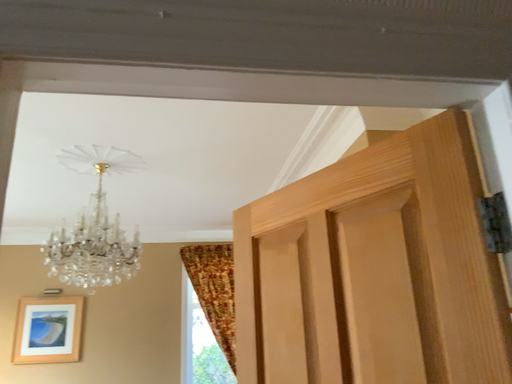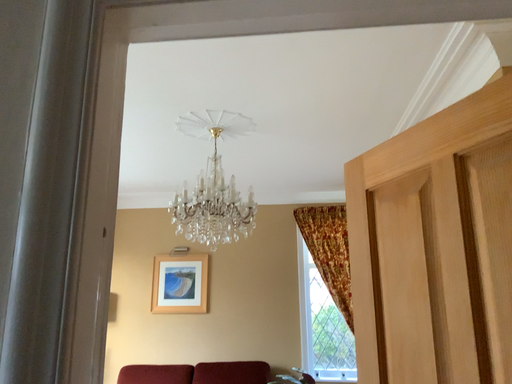
Question: How did the camera likely rotate when shooting the video?

Choices:
 (A) rotated left
 (B) rotated right

Answer: (A)